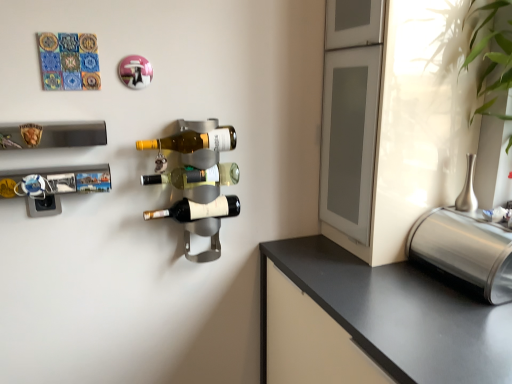
Question: Are translucent glass bottle at center, which is the second beer bottle from top to bottom, and matte glass beer bottle at center, positioned as the third beer bottle in bottom-to-top order, far apart?

Choices:
 (A) no
 (B) yes

Answer: (A)

Question: Is translucent glass bottle at center, placed as the 2th beer bottle when sorted from bottom to top, at the left side of matte glass beer bottle at center, positioned as the third beer bottle in bottom-to-top order?

Choices:
 (A) no
 (B) yes

Answer: (A)

Question: From the image's perspective, is translucent glass bottle at center, placed as the 2th beer bottle when sorted from bottom to top, above matte glass beer bottle at center, which is the 1th beer bottle in top-to-bottom order?

Choices:
 (A) yes
 (B) no

Answer: (B)

Question: Is translucent glass bottle at center, placed as the 2th beer bottle when sorted from bottom to top, looking in the opposite direction of matte glass beer bottle at center, which is the 1th beer bottle in top-to-bottom order?

Choices:
 (A) no
 (B) yes

Answer: (A)

Question: Is translucent glass bottle at center, which is the second beer bottle from top to bottom, touching matte glass beer bottle at center, which is the 1th beer bottle in top-to-bottom order?

Choices:
 (A) yes
 (B) no

Answer: (A)

Question: From a real-world perspective, is matte glass beer bottle at center, positioned as the third beer bottle in bottom-to-top order, physically located above or below shiny metallic wine bottle at center, which ranks as the third beer bottle in top-to-bottom order?

Choices:
 (A) above
 (B) below

Answer: (A)

Question: In the image, is matte glass beer bottle at center, which is the 1th beer bottle in top-to-bottom order, positioned in front of or behind shiny metallic wine bottle at center, which ranks as the third beer bottle in top-to-bottom order?

Choices:
 (A) front
 (B) behind

Answer: (A)

Question: Is point (203, 145) positioned closer to the camera than point (163, 213)?

Choices:
 (A) farther
 (B) closer

Answer: (B)

Question: In the image, is matte glass beer bottle at center, positioned as the third beer bottle in bottom-to-top order, on the left side or the right side of shiny metallic wine bottle at center, the 1th beer bottle from the bottom?

Choices:
 (A) right
 (B) left

Answer: (B)

Question: Considering the positions of translucent glass bottle at center, placed as the 2th beer bottle when sorted from bottom to top, and matte glass beer bottle at center, positioned as the third beer bottle in bottom-to-top order, in the image, is translucent glass bottle at center, placed as the 2th beer bottle when sorted from bottom to top, bigger or smaller than matte glass beer bottle at center, positioned as the third beer bottle in bottom-to-top order,?

Choices:
 (A) small
 (B) big

Answer: (A)

Question: Is point (198, 178) positioned closer to the camera than point (218, 135)?

Choices:
 (A) farther
 (B) closer

Answer: (A)

Question: Is translucent glass bottle at center, placed as the 2th beer bottle when sorted from bottom to top, to the left or to the right of matte glass beer bottle at center, positioned as the third beer bottle in bottom-to-top order, in the image?

Choices:
 (A) left
 (B) right

Answer: (B)

Question: In terms of width, does translucent glass bottle at center, placed as the 2th beer bottle when sorted from bottom to top, look wider or thinner when compared to matte glass beer bottle at center, which is the 1th beer bottle in top-to-bottom order?

Choices:
 (A) thin
 (B) wide

Answer: (A)

Question: In terms of size, does metallic silver wine rack at left, which appears as the 1th wine rack when ordered from the bottom, appear bigger or smaller than shiny metallic wine bottle at center, which ranks as the third beer bottle in top-to-bottom order?

Choices:
 (A) small
 (B) big

Answer: (A)

Question: Is metallic silver wine rack at left, which appears as the 1th wine rack when ordered from the bottom, wider or thinner than shiny metallic wine bottle at center, the 1th beer bottle from the bottom?

Choices:
 (A) wide
 (B) thin

Answer: (B)